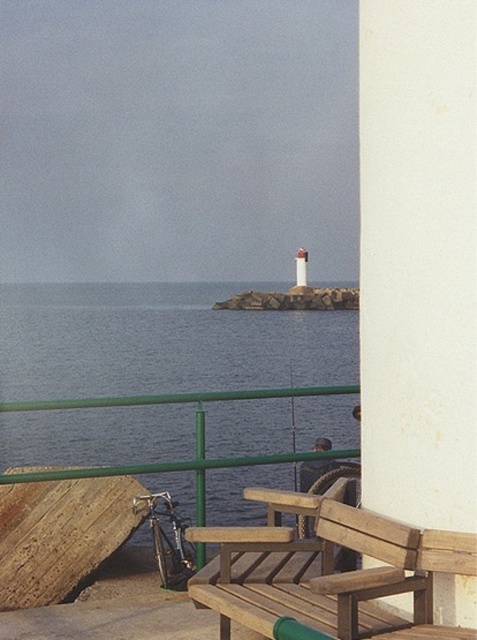
In the scene shown: You are standing on the wooden deck and want to know if the white matte lighthouse at center is above or below the blue water at center. Based on the scene, can you determine this?

The blue water at center is positioned under the white matte lighthouse at center, so the lighthouse is above the water.

You are standing on the wooden deck and want to take a photo of both the blue water at center and the wooden bench at center. Which object should you position to your right side to include both in the frame?

The blue water at center is to the left of the wooden bench at center. To include both in the frame, position the wooden bench at center to your right side so that the blue water at center remains on the left.